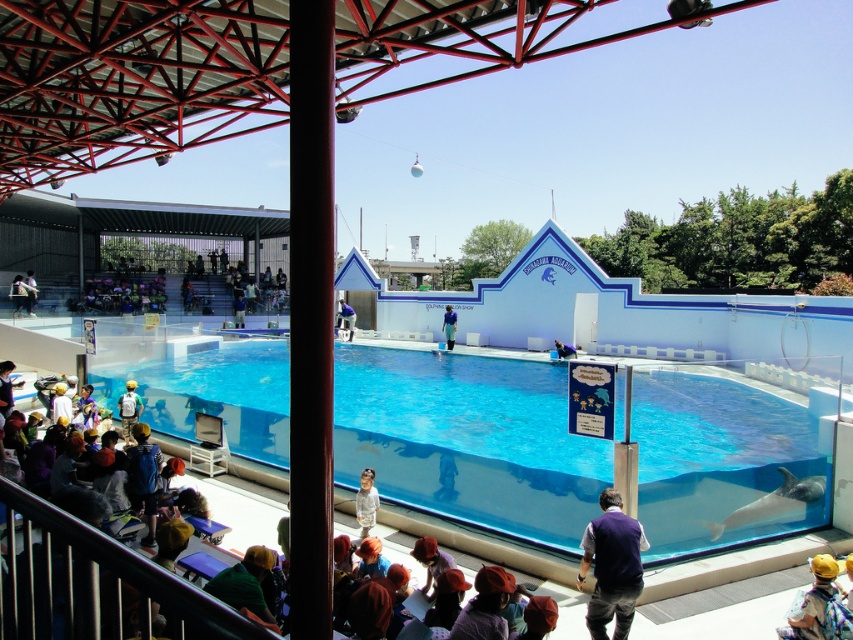
Question: Which point appears closest to the camera in this image?

Choices:
 (A) (152, 296)
 (B) (567, 346)
 (C) (625, 604)
 (D) (340, 310)

Answer: (C)

Question: Which of the following is the farthest from the observer?

Choices:
 (A) metallic gray rail at lower left
 (B) blue fabric at center
 (C) blue fabric shirt at center
 (D) dark blue vest at lower center

Answer: (C)

Question: Is dark blue vest at lower center wider than blue fabric shirt at center?

Choices:
 (A) yes
 (B) no

Answer: (A)

Question: Which of the following is the closest to the observer?

Choices:
 (A) (129, 285)
 (B) (444, 324)

Answer: (B)

Question: Is matte purple seats at upper left closer to the viewer compared to white matte jacket at center?

Choices:
 (A) yes
 (B) no

Answer: (B)

Question: Is yellow fabric backpack at lower right further to the viewer compared to matte purple seats at upper left?

Choices:
 (A) yes
 (B) no

Answer: (B)